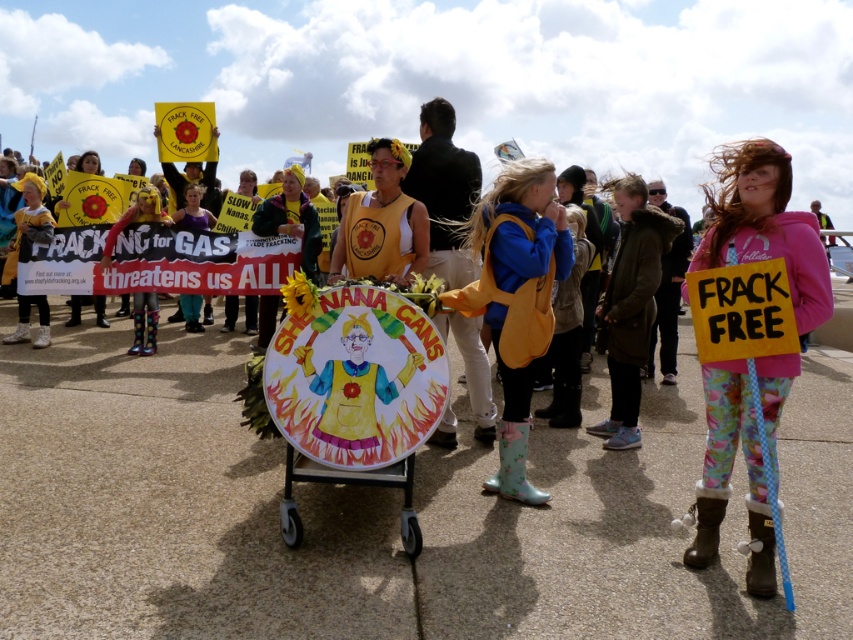
Question: Which point appears farthest from the camera in this image?

Choices:
 (A) (503, 236)
 (B) (749, 580)

Answer: (A)

Question: Does pink fleece jacket at right lie in front of blue fabric backpack at center?

Choices:
 (A) no
 (B) yes

Answer: (B)

Question: Does pink fleece jacket at right lie behind blue fabric backpack at center?

Choices:
 (A) no
 (B) yes

Answer: (A)

Question: Does pink fleece jacket at right have a greater width compared to blue fabric backpack at center?

Choices:
 (A) yes
 (B) no

Answer: (B)

Question: Which point appears closest to the camera in this image?

Choices:
 (A) (495, 208)
 (B) (735, 257)

Answer: (B)